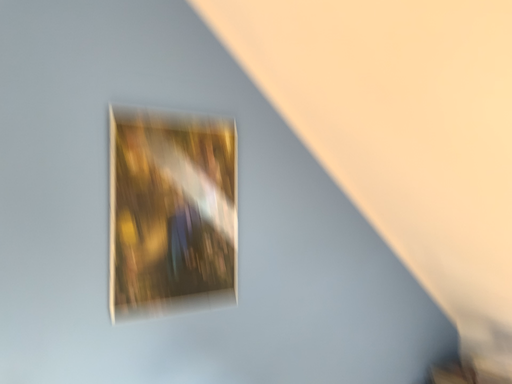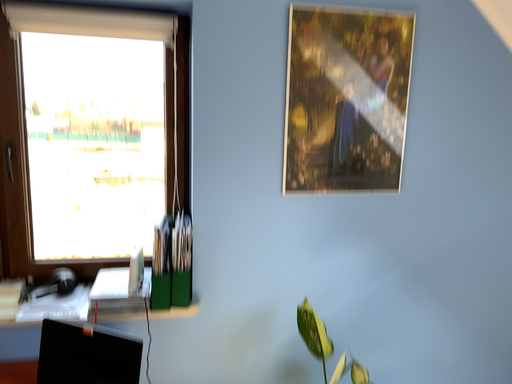
Question: How did the camera likely rotate when shooting the video?

Choices:
 (A) rotated downward
 (B) rotated upward

Answer: (A)